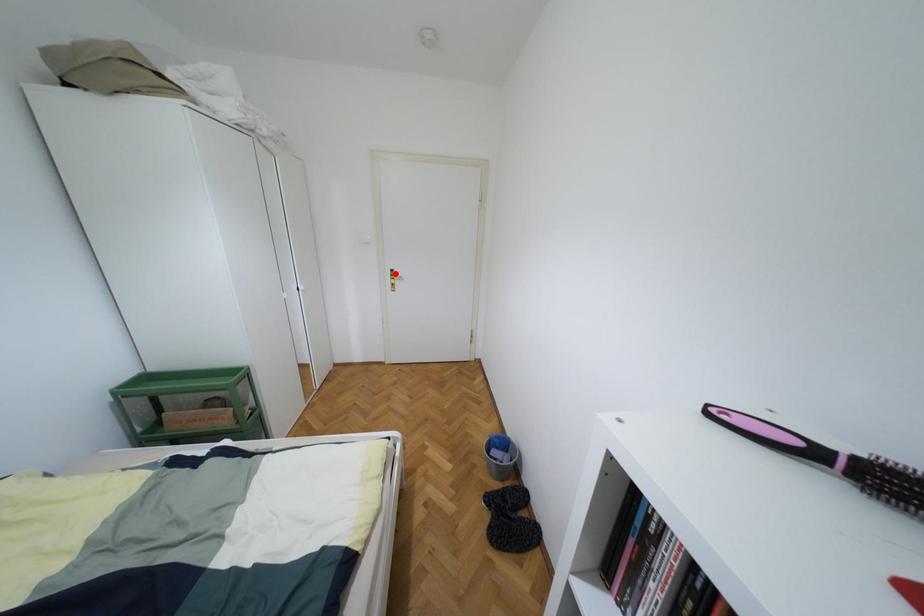
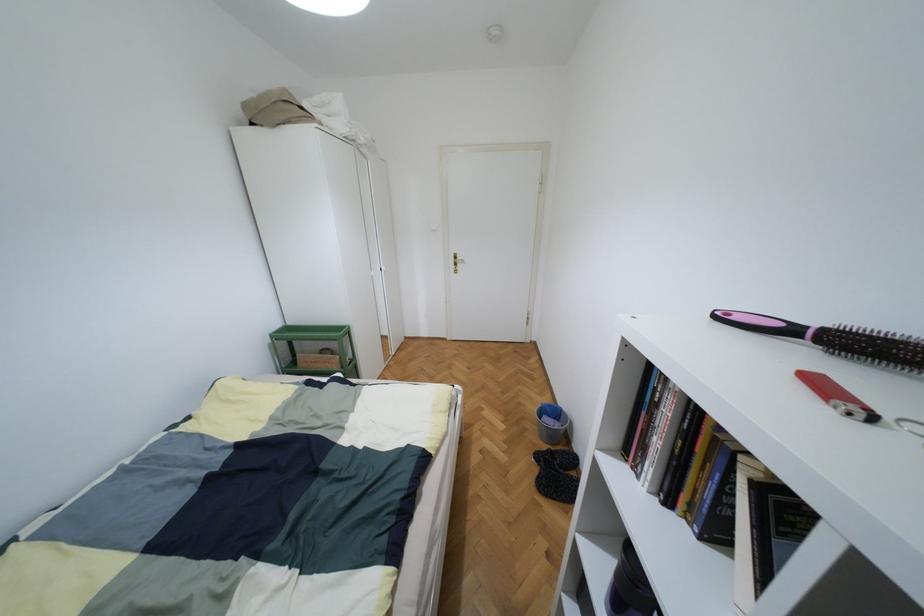
Locate, in the second image, the point that corresponds to the highlighted location in the first image.

(457, 257)